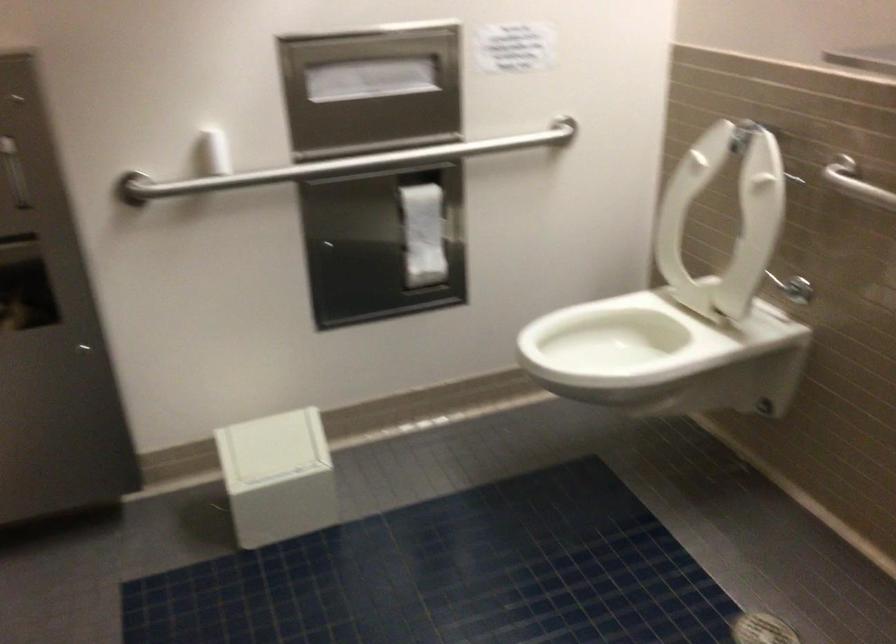
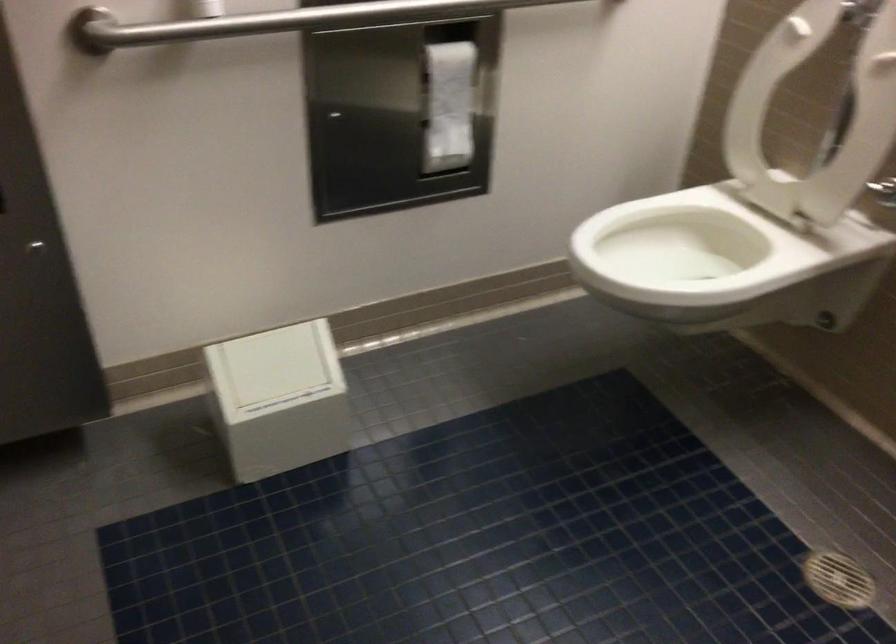
Where in the second image is the point corresponding to (x=762, y=406) from the first image?

(824, 321)